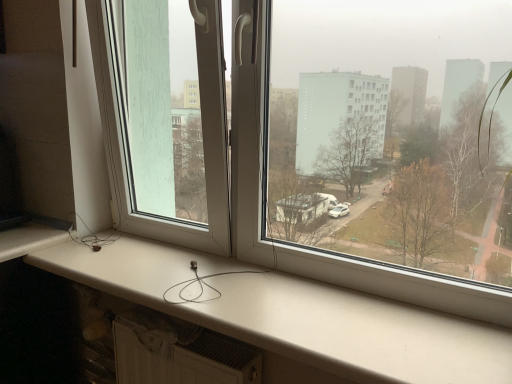
Describe the element at coordinates (296, 315) in the screenshot. The image size is (512, 384). I see `white matte window sill at lower center` at that location.

This screenshot has width=512, height=384. Identify the location of white matte window sill at lower center. (296, 315).

In the scene shown: Measure the distance between transparent plastic window screen at left and camera.

transparent plastic window screen at left and camera are 3.58 feet apart.

Find the location of a particular element. transparent plastic window screen at left is located at coordinates (133, 134).

What do you see at coordinates (133, 134) in the screenshot?
I see `transparent plastic window screen at left` at bounding box center [133, 134].

I want to click on white matte window sill at lower center, so click(296, 315).

Can you confirm if transparent plastic window screen at left is positioned to the right of white matte window sill at lower center?

No, transparent plastic window screen at left is not to the right of white matte window sill at lower center.

Which object is closer to the camera taking this photo, transparent plastic window screen at left or white matte window sill at lower center?

white matte window sill at lower center.

Considering the points (208, 219) and (294, 324), which point is in front, point (208, 219) or point (294, 324)?

The point (294, 324) is more forward.

From the image's perspective, between transparent plastic window screen at left and white matte window sill at lower center, which one is located above?

transparent plastic window screen at left, from the image's perspective.

From a real-world perspective, is transparent plastic window screen at left over white matte window sill at lower center?

Yes.

Which object is wider, transparent plastic window screen at left or white matte window sill at lower center?

white matte window sill at lower center is wider.

Between transparent plastic window screen at left and white matte window sill at lower center, which one has less height?

With less height is white matte window sill at lower center.

Does transparent plastic window screen at left have a larger size compared to white matte window sill at lower center?

Yes, transparent plastic window screen at left is bigger than white matte window sill at lower center.

Is transparent plastic window screen at left inside or outside of white matte window sill at lower center?

The correct answer is: outside.

Is transparent plastic window screen at left beside white matte window sill at lower center?

No, transparent plastic window screen at left is not making contact with white matte window sill at lower center.

Does transparent plastic window screen at left turn towards white matte window sill at lower center?

No, transparent plastic window screen at left is not oriented towards white matte window sill at lower center.

How much distance is there between transparent plastic window screen at left and white matte window sill at lower center?

They are 15.80 inches apart.

Find the location of a particular element. window screen that appears above the white matte window sill at lower center (from a real-world perspective) is located at coordinates (133, 134).

Considering the relative positions of white matte window sill at lower center and transparent plastic window screen at left in the image provided, is white matte window sill at lower center to the left or to the right of transparent plastic window screen at left?

Clearly, white matte window sill at lower center is on the right of transparent plastic window screen at left in the image.

Relative to transparent plastic window screen at left, is white matte window sill at lower center in front or behind?

In the image, white matte window sill at lower center appears in front of transparent plastic window screen at left.

Considering the positions of points (397, 359) and (111, 163), is point (397, 359) closer to camera compared to point (111, 163)?

Yes, point (397, 359) is in front of point (111, 163).

From the image's perspective, which object appears higher, white matte window sill at lower center or transparent plastic window screen at left?

From the image's view, transparent plastic window screen at left is above.

From a real-world perspective, is white matte window sill at lower center physically below transparent plastic window screen at left?

Yes, from a real-world perspective, white matte window sill at lower center is beneath transparent plastic window screen at left.

Does white matte window sill at lower center have a greater width compared to transparent plastic window screen at left?

Indeed, white matte window sill at lower center has a greater width compared to transparent plastic window screen at left.

From the picture: Considering the relative sizes of white matte window sill at lower center and transparent plastic window screen at left in the image provided, is white matte window sill at lower center shorter than transparent plastic window screen at left?

Indeed, white matte window sill at lower center has a lesser height compared to transparent plastic window screen at left.

Can you confirm if white matte window sill at lower center is bigger than transparent plastic window screen at left?

No, white matte window sill at lower center is not bigger than transparent plastic window screen at left.

Is white matte window sill at lower center inside the boundaries of transparent plastic window screen at left, or outside?

white matte window sill at lower center lies outside transparent plastic window screen at left.

Does white matte window sill at lower center touch transparent plastic window screen at left?

white matte window sill at lower center and transparent plastic window screen at left are clearly separated.

Is white matte window sill at lower center oriented away from transparent plastic window screen at left?

No, white matte window sill at lower center's orientation is not away from transparent plastic window screen at left.

How many degrees apart are the facing directions of white matte window sill at lower center and transparent plastic window screen at left?

The angular difference between white matte window sill at lower center and transparent plastic window screen at left is 9.47 degrees.

Identify the location of window screen behind the white matte window sill at lower center. The width and height of the screenshot is (512, 384). (133, 134).

Find the location of a particular element. This screenshot has height=384, width=512. window sill below the transparent plastic window screen at left (from the image's perspective) is located at coordinates (296, 315).

Find the location of a particular element. window screen above the white matte window sill at lower center (from the image's perspective) is located at coordinates (133, 134).